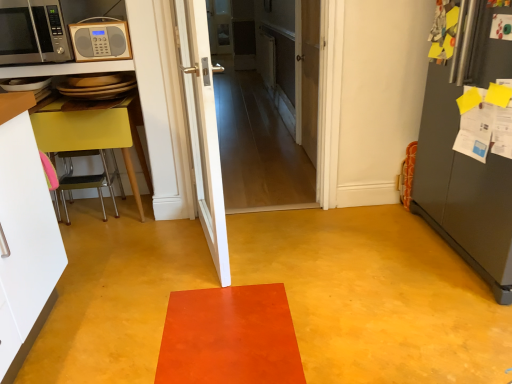
At what (x,y) coordinates should I click in order to perform the action: click on free space in front of white wooden door at center, the 2th door positioned from the front. Please return your answer as a coordinate pair (x, y). Looking at the image, I should click on (261, 251).